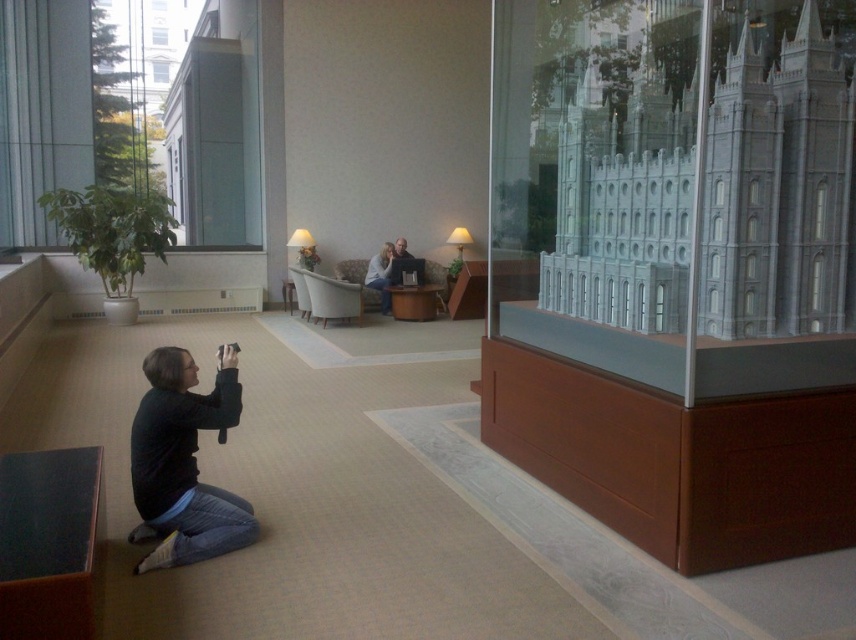
You are a GUI agent. You are given a task and a screenshot of the screen. Output one action in this format:
    pyautogui.click(x=<x>, y=<y>)
    Task: Click on the black fabric squat at lower left
    Image resolution: width=856 pixels, height=640 pixels.
    Given the screenshot: What is the action you would take?
    pyautogui.click(x=183, y=461)

Measure the distance from black fabric squat at lower left to light brown leather couch at center.

black fabric squat at lower left and light brown leather couch at center are 6.94 meters apart.

Which is in front, point (218, 358) or point (384, 310)?

Point (218, 358)

The height and width of the screenshot is (640, 856). In order to click on black fabric squat at lower left in this screenshot , I will do `click(183, 461)`.